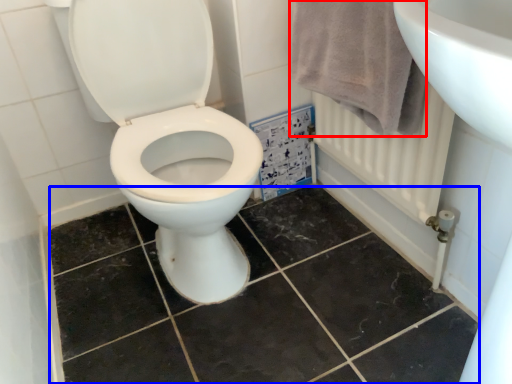
Question: Which object is closer to the camera taking this photo, bath towel (highlighted by a red box) or ceramic tile (highlighted by a blue box)?

Choices:
 (A) bath towel
 (B) ceramic tile

Answer: (B)